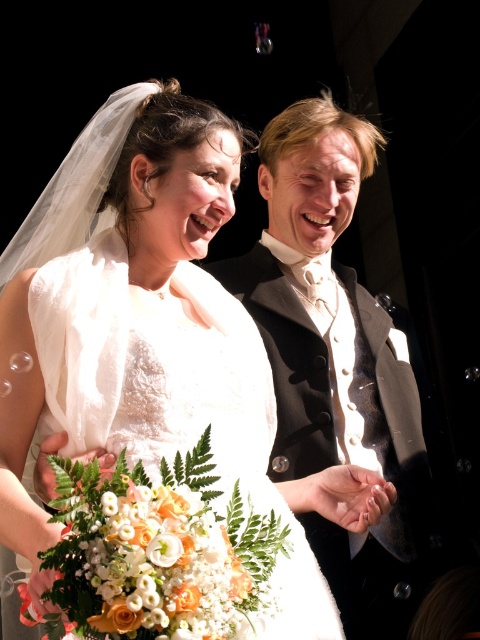
Which is in front, point (337, 134) or point (322, 637)?

Point (322, 637) is in front.

Can you confirm if shiny black suit at center is smaller than white satin dress at center?

Actually, shiny black suit at center might be larger than white satin dress at center.

Does point (399, 417) come behind point (117, 380)?

Yes.

Locate an element on the screen. This screenshot has width=480, height=640. shiny black suit at center is located at coordinates (336, 362).